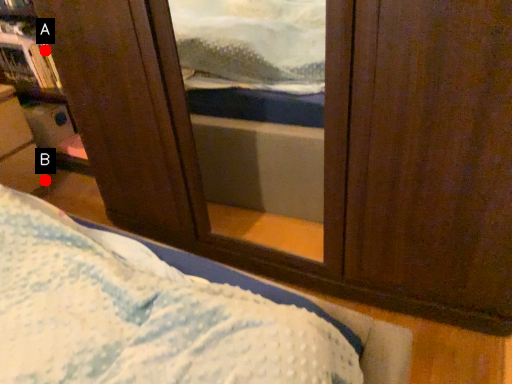
Question: Two points are circled on the image, labeled by A and B beside each circle. Which point is farther to the camera?

Choices:
 (A) A is further
 (B) B is further

Answer: (B)